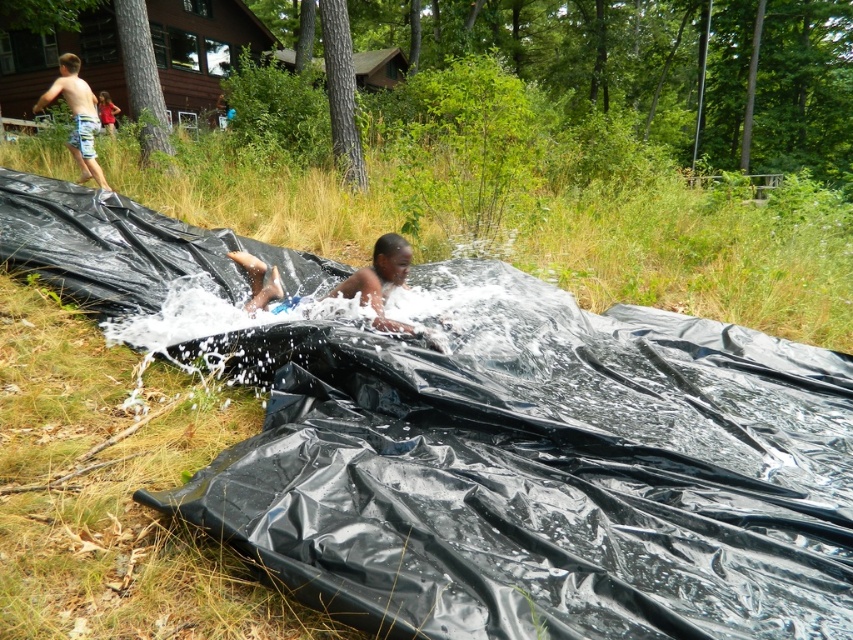
Who is positioned more to the left, light blue striped shorts at upper left or red fabric shirt at upper left?

light blue striped shorts at upper left

Does point (76, 72) come farther from viewer compared to point (107, 99)?

That is False.

I want to click on light blue striped shorts at upper left, so click(77, 116).

Does matte black child at center have a lesser height compared to red fabric shirt at upper left?

Incorrect, matte black child at center's height does not fall short of red fabric shirt at upper left's.

Is point (228, 253) positioned behind point (99, 99)?

No.

Is point (373, 273) behind point (109, 131)?

No.

I want to click on matte black child at center, so click(380, 280).

Can you confirm if green grass at lower center is positioned to the left of light blue striped shorts at upper left?

Incorrect, green grass at lower center is not on the left side of light blue striped shorts at upper left.

Who is taller, green grass at lower center or light blue striped shorts at upper left?

light blue striped shorts at upper left

Between point (579, 189) and point (82, 116), which one is positioned in front?

Positioned in front is point (82, 116).

In order to click on green grass at lower center in this screenshot , I will do `click(695, 253)`.